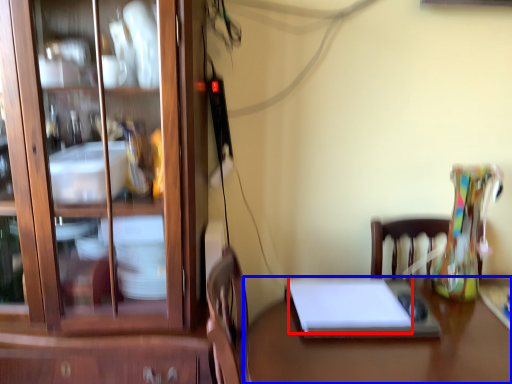
Question: Among these objects, which one is farthest to the camera, notebook (highlighted by a red box) or desk (highlighted by a blue box)?

Choices:
 (A) notebook
 (B) desk

Answer: (A)